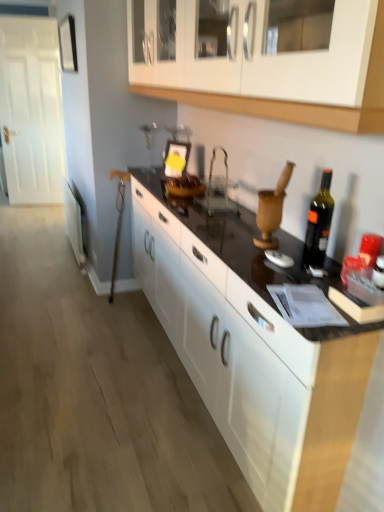
Question: Could you tell me if black glass bottle at right is facing black glossy countertop at center?

Choices:
 (A) yes
 (B) no

Answer: (B)

Question: Does black glass bottle at right appear on the left side of black glossy countertop at center?

Choices:
 (A) no
 (B) yes

Answer: (A)

Question: Are black glass bottle at right and black glossy countertop at center making contact?

Choices:
 (A) no
 (B) yes

Answer: (A)

Question: Does black glass bottle at right lie in front of black glossy countertop at center?

Choices:
 (A) yes
 (B) no

Answer: (B)

Question: From the image's perspective, is black glass bottle at right located above black glossy countertop at center?

Choices:
 (A) yes
 (B) no

Answer: (A)

Question: Would you say black glass bottle at right is to the left or to the right of black glossy countertop at center in the picture?

Choices:
 (A) left
 (B) right

Answer: (B)

Question: Considering the positions of black glass bottle at right and black glossy countertop at center in the image, is black glass bottle at right bigger or smaller than black glossy countertop at center?

Choices:
 (A) small
 (B) big

Answer: (A)

Question: Is point (322, 203) positioned closer to the camera than point (263, 273)?

Choices:
 (A) closer
 (B) farther

Answer: (B)

Question: From a real-world perspective, is black glass bottle at right positioned above or below black glossy countertop at center?

Choices:
 (A) below
 (B) above

Answer: (B)

Question: Looking at their shapes, would you say black glossy countertop at center is wider or thinner than white glossy cabinet at upper center?

Choices:
 (A) wide
 (B) thin

Answer: (A)

Question: Is point (286, 242) closer or farther from the camera than point (163, 90)?

Choices:
 (A) farther
 (B) closer

Answer: (B)

Question: Considering their positions, is black glossy countertop at center located in front of or behind white glossy cabinet at upper center?

Choices:
 (A) front
 (B) behind

Answer: (B)

Question: From the image's perspective, relative to white glossy cabinet at upper center, is black glossy countertop at center above or below?

Choices:
 (A) above
 (B) below

Answer: (B)

Question: Is white glossy cabinet at upper center wider or thinner than black glossy countertop at center?

Choices:
 (A) thin
 (B) wide

Answer: (A)

Question: Is white glossy cabinet at upper center in front of or behind black glossy countertop at center in the image?

Choices:
 (A) front
 (B) behind

Answer: (A)